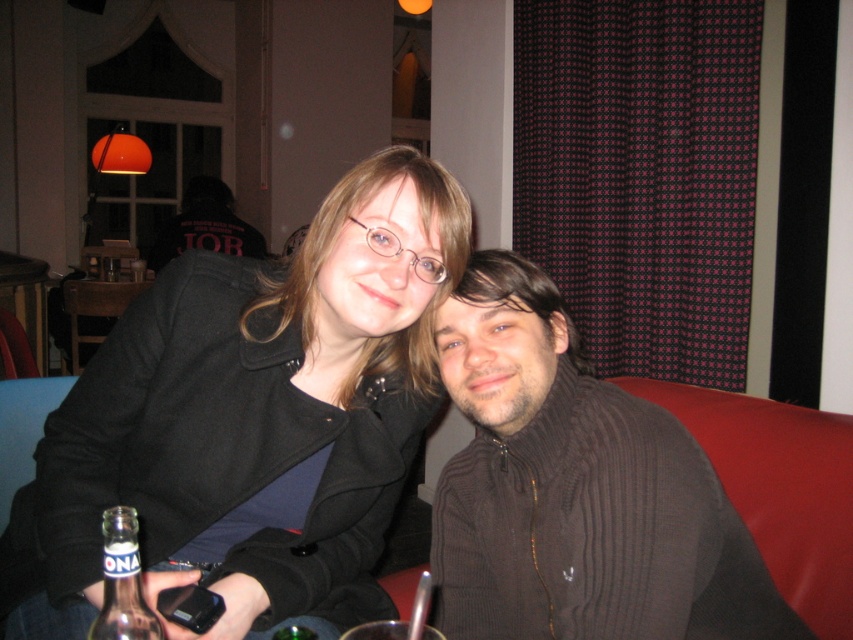
Question: Which point is closer to the camera taking this photo?

Choices:
 (A) (140, 627)
 (B) (511, 604)

Answer: (A)

Question: Can you confirm if dark brown sweater at right is wider than clear glass bottle at lower left?

Choices:
 (A) no
 (B) yes

Answer: (B)

Question: Among these objects, which one is farthest from the camera?

Choices:
 (A) clear glass bottle at lower left
 (B) black matte jacket at upper left
 (C) dark brown sweater at right

Answer: (B)

Question: Which of these objects is positioned closest to the clear glass bottle at lower left?

Choices:
 (A) black matte jacket at upper left
 (B) dark brown sweater at right

Answer: (A)

Question: Can you confirm if black matte jacket at upper left is positioned below dark brown sweater at right?

Choices:
 (A) yes
 (B) no

Answer: (B)

Question: Is dark brown sweater at right bigger than clear glass bottle at lower left?

Choices:
 (A) no
 (B) yes

Answer: (B)